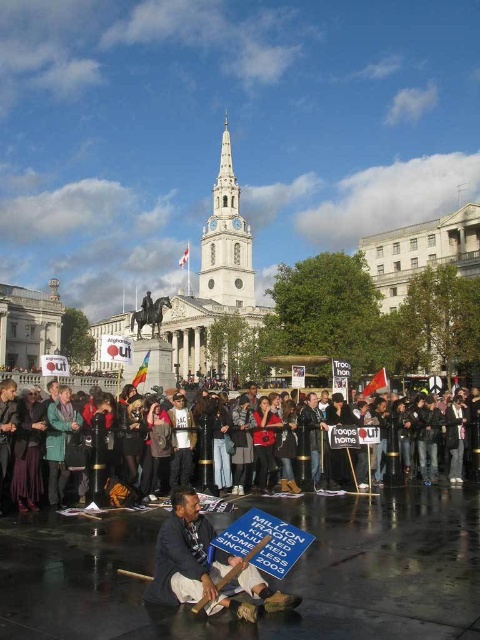
Who is lower down, blue fabric sign at lower center or dark brown leather jacket at center?

blue fabric sign at lower center is below.

Does blue fabric sign at lower center appear on the right side of dark brown leather jacket at center?

Correct, you'll find blue fabric sign at lower center to the right of dark brown leather jacket at center.

Measure the distance between point (189, 556) and camera.

The distance of point (189, 556) from camera is 42.25 meters.

You are a GUI agent. You are given a task and a screenshot of the screen. Output one action in this format:
    pyautogui.click(x=<x>, y=<y>)
    Task: Click on the blue fabric sign at lower center
    The height and width of the screenshot is (640, 480).
    Given the screenshot: What is the action you would take?
    pyautogui.click(x=204, y=564)